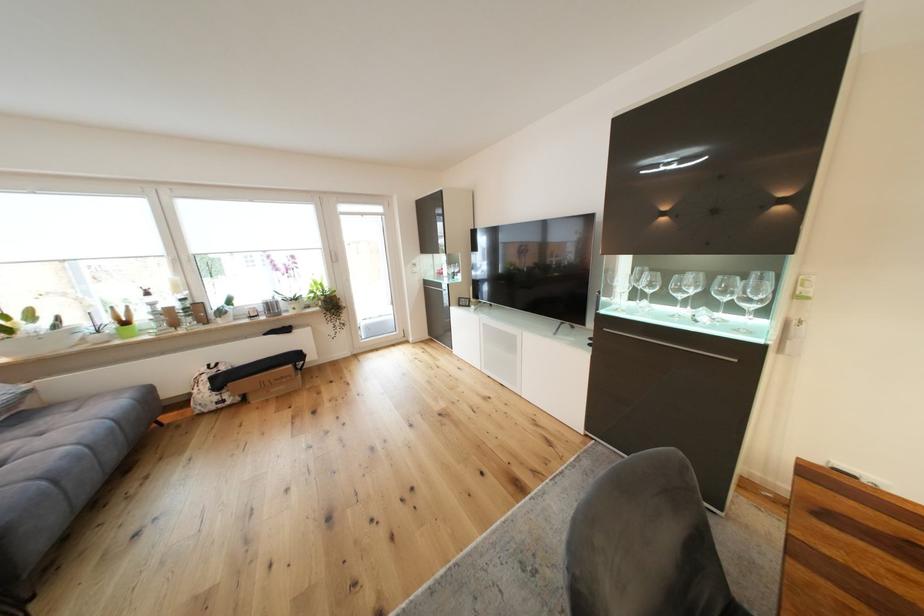
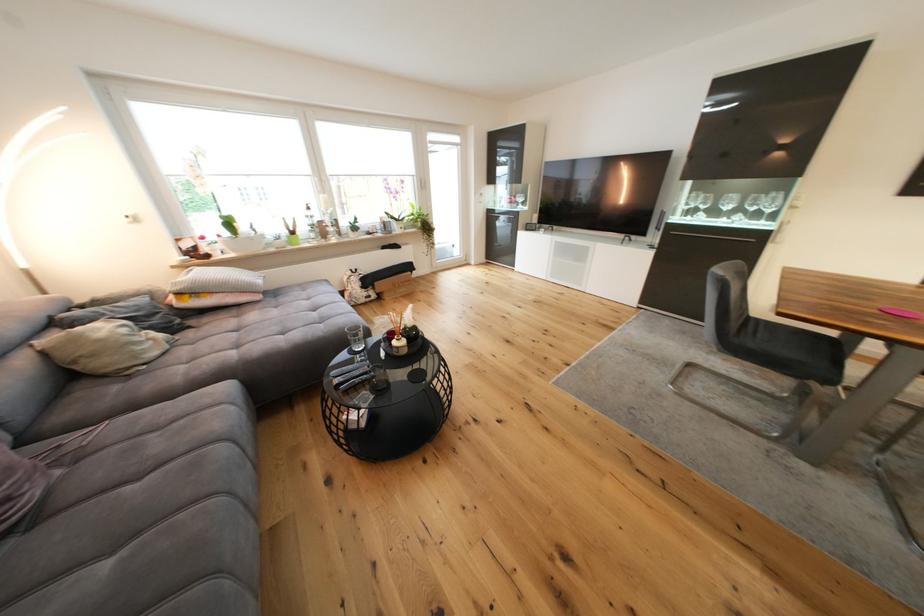
In the second image, find the point that corresponds to the point at 224,400 in the first image.

(372, 296)